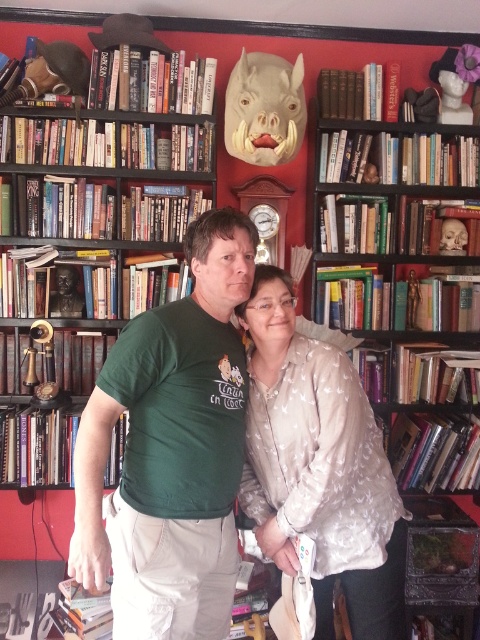
Question: Can you confirm if green cotton shirt at center is positioned to the right of silky beige blouse at center?

Choices:
 (A) yes
 (B) no

Answer: (B)

Question: Which point is closer to the camera?

Choices:
 (A) silky beige blouse at center
 (B) hardcover books at right
 (C) wooden bookshelf at left
 (D) green cotton shirt at center

Answer: (D)

Question: Can you confirm if wooden bookshelf at left is smaller than silky beige blouse at center?

Choices:
 (A) no
 (B) yes

Answer: (A)

Question: Based on their relative distances, which object is farther from the hardcover books at right?

Choices:
 (A) green cotton shirt at center
 (B) wooden bookshelf at left

Answer: (A)

Question: Is hardcover books at right above silky beige blouse at center?

Choices:
 (A) no
 (B) yes

Answer: (B)

Question: Among these objects, which one is farthest from the camera?

Choices:
 (A) silky beige blouse at center
 (B) green cotton shirt at center
 (C) hardcover books at right

Answer: (C)